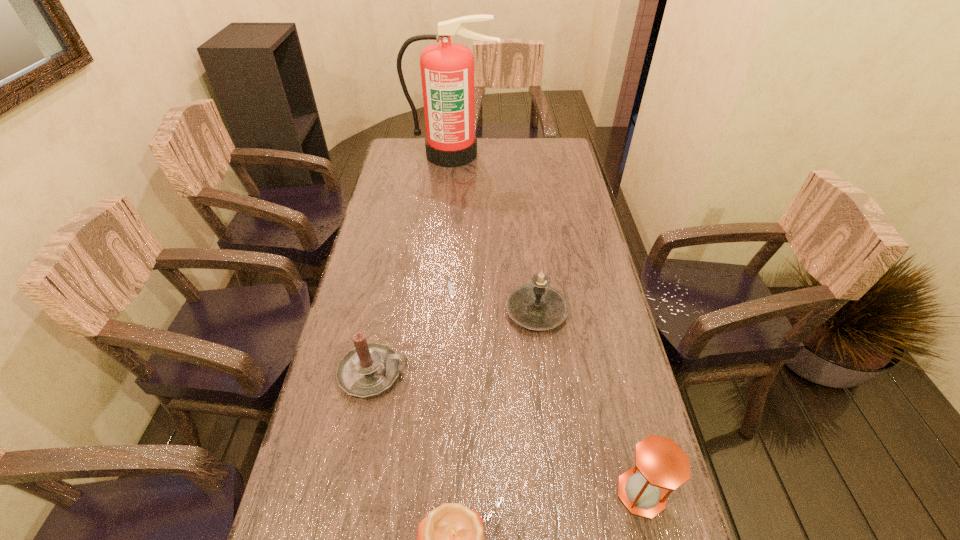
Select which candle is the second closest to the third farthest object. Please provide its 2D coordinates. Your answer should be formatted as a tuple, i.e. [(x, y)], where the tuple contains the x and y coordinates of a point satisfying the conditions above.

[(537, 306)]

The image size is (960, 540). In order to click on vacant space that satisfies the following two spatial constraints: 1. on the side of the rightmost object with the handle loop; 2. on the right side of the second nearest candle in this screenshot , I will do point(350,493).

Image resolution: width=960 pixels, height=540 pixels. Find the location of `blank area in the image that satisfies the following two spatial constraints: 1. at the nozzle of the rightmost object; 2. on the right side of the farthest object`. blank area in the image that satisfies the following two spatial constraints: 1. at the nozzle of the rightmost object; 2. on the right side of the farthest object is located at coordinates (422, 493).

Image resolution: width=960 pixels, height=540 pixels. I want to click on free location that satisfies the following two spatial constraints: 1. on the side of the second nearest candle with the handle loop; 2. on the right side of the hourglass, so click(350, 493).

Where is `vacant space that satisfies the following two spatial constraints: 1. on the side of the leftmost candle with the handle loop; 2. on the left side of the hourglass`? The height and width of the screenshot is (540, 960). vacant space that satisfies the following two spatial constraints: 1. on the side of the leftmost candle with the handle loop; 2. on the left side of the hourglass is located at coordinates (350, 493).

This screenshot has height=540, width=960. I want to click on free space that satisfies the following two spatial constraints: 1. at the nozzle of the rightmost object; 2. on the left side of the tallest object, so click(x=422, y=493).

At what (x,y) coordinates should I click in order to perform the action: click on vacant position in the image that satisfies the following two spatial constraints: 1. on the side of the third nearest object with the handle loop; 2. on the right side of the hourglass. Please return your answer as a coordinate pair (x, y). Image resolution: width=960 pixels, height=540 pixels. Looking at the image, I should click on click(x=350, y=493).

At what (x,y) coordinates should I click in order to perform the action: click on vacant area in the image that satisfies the following two spatial constraints: 1. at the nozzle of the fire extinguisher; 2. on the left side of the rightmost candle. Please return your answer as a coordinate pair (x, y). Looking at the image, I should click on (439, 312).

Image resolution: width=960 pixels, height=540 pixels. Find the location of `blank area in the image that satisfies the following two spatial constraints: 1. at the nozzle of the farthest object; 2. on the left side of the hourglass`. blank area in the image that satisfies the following two spatial constraints: 1. at the nozzle of the farthest object; 2. on the left side of the hourglass is located at coordinates (422, 493).

Identify the location of free location that satisfies the following two spatial constraints: 1. at the nozzle of the tallest object; 2. on the side of the third farthest object with the handle loop. (433, 373).